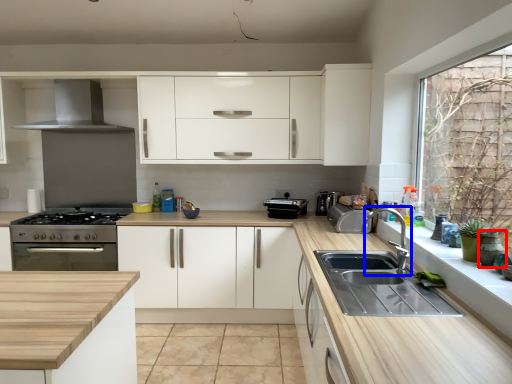
Question: Which object appears farthest to the camera in this image, appliance (highlighted by a red box) or tap (highlighted by a blue box)?

Choices:
 (A) appliance
 (B) tap

Answer: (B)